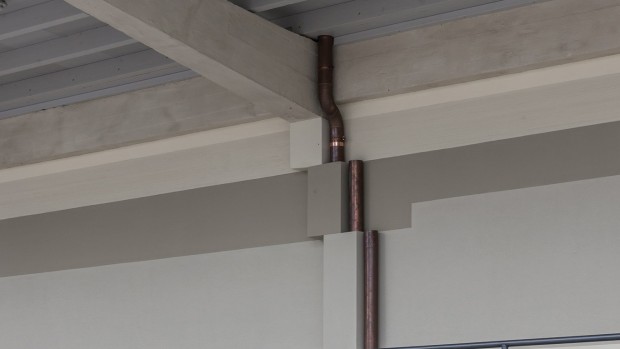
You are a GUI agent. You are given a task and a screenshot of the screen. Output one action in this format:
    pyautogui.click(x=<x>, y=<y>)
    Task: Click on the wall
    
    Given the screenshot: What is the action you would take?
    pyautogui.click(x=482, y=288), pyautogui.click(x=303, y=282)